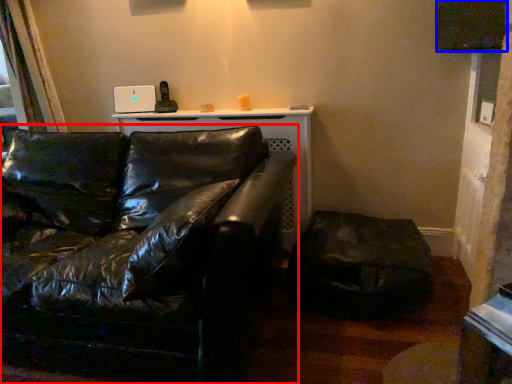
Question: Which point is further to the camera, studio couch (highlighted by a red box) or window screen (highlighted by a blue box)?

Choices:
 (A) studio couch
 (B) window screen

Answer: (B)